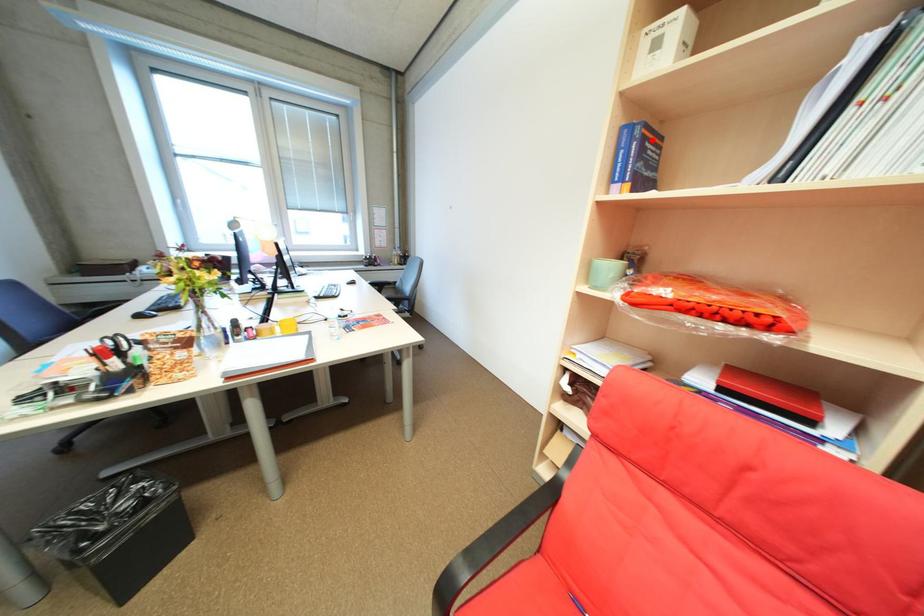
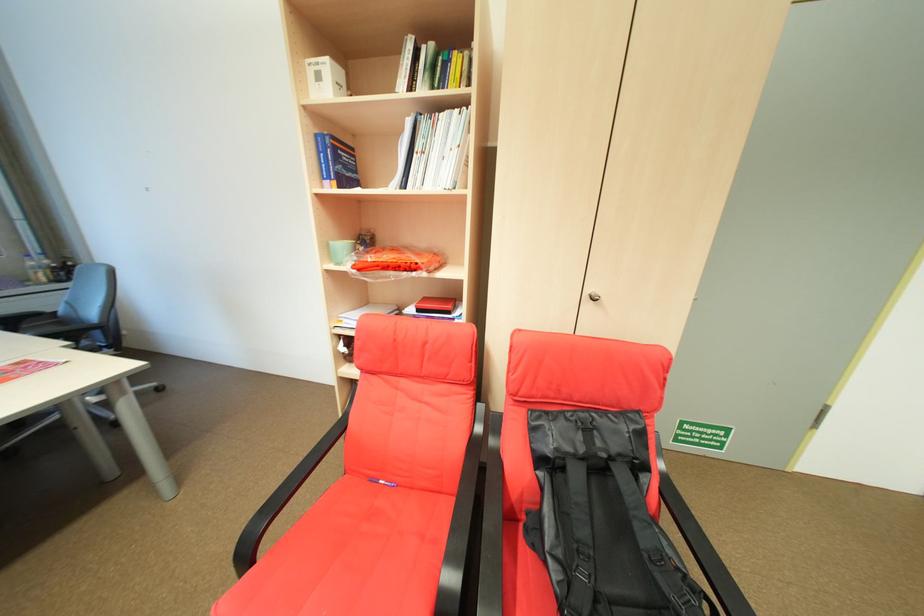
Locate, in the second image, the point that corresponds to the highlighted location in the first image.

(344, 148)